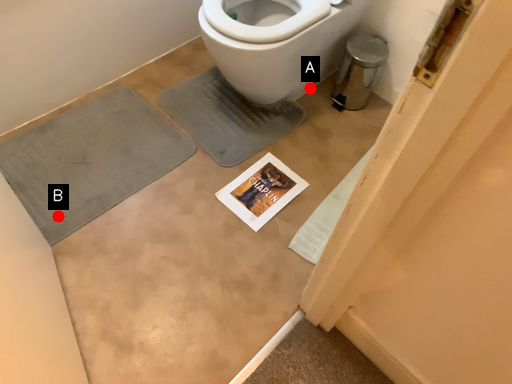
Question: Two points are circled on the image, labeled by A and B beside each circle. Which point appears closest to the camera in this image?

Choices:
 (A) A is closer
 (B) B is closer

Answer: (B)